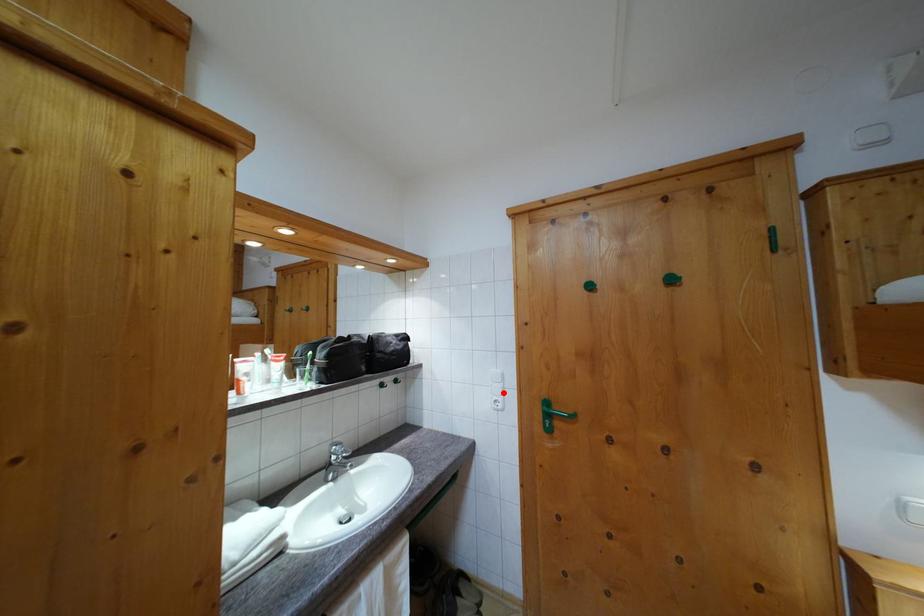
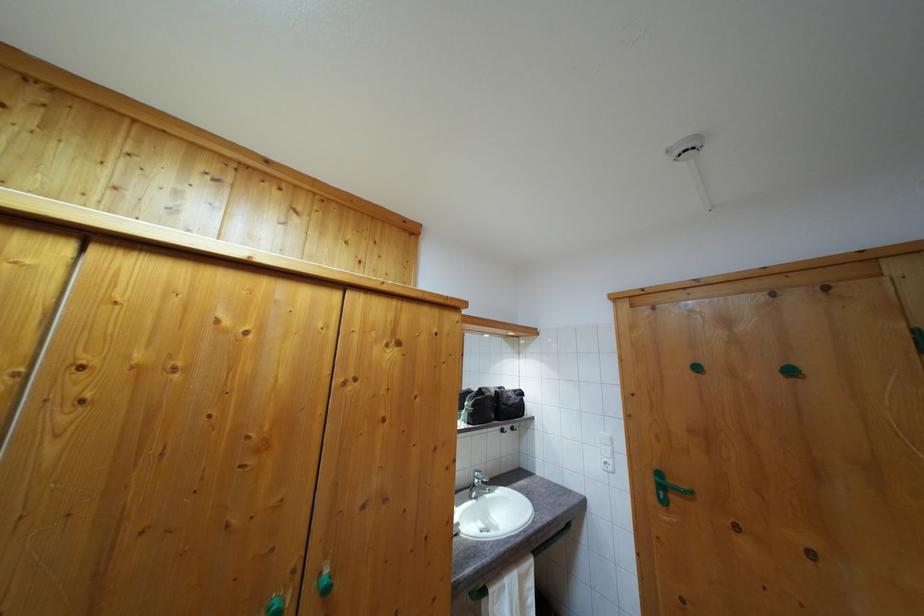
Question: I am providing you with two images of the same scene from different viewpoints. A red point is marked on the first image. Can you still see the location of the red point in image 2?

Choices:
 (A) Yes
 (B) No

Answer: (A)